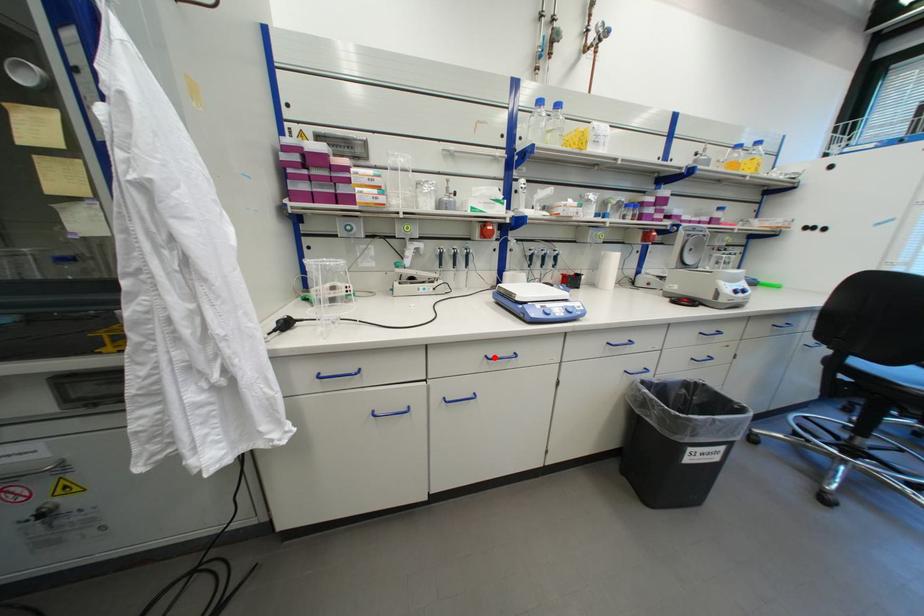
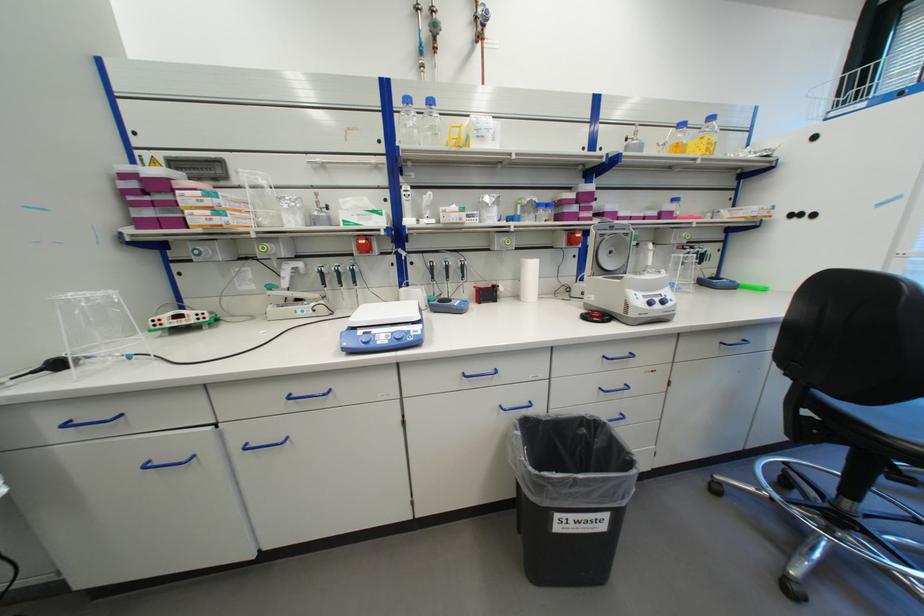
Where in the second image is the point corresponding to the highlighted location from the first image?

(298, 395)